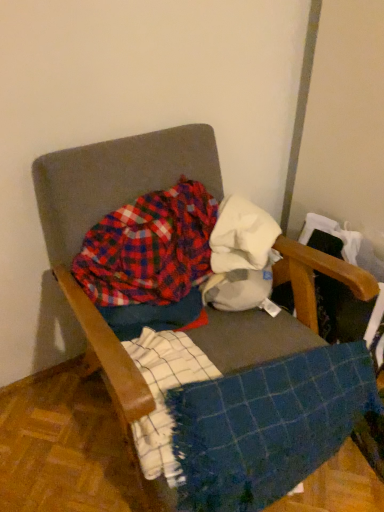
Question: Is plaid cotton shirt at center placed right next to white cotton cloth at center?

Choices:
 (A) no
 (B) yes

Answer: (A)

Question: Can you confirm if plaid cotton shirt at center is taller than white cotton cloth at center?

Choices:
 (A) no
 (B) yes

Answer: (B)

Question: Is the position of plaid cotton shirt at center less distant than that of white cotton cloth at center?

Choices:
 (A) no
 (B) yes

Answer: (B)

Question: From the image's perspective, would you say plaid cotton shirt at center is shown under white cotton cloth at center?

Choices:
 (A) no
 (B) yes

Answer: (B)

Question: Considering the relative positions of plaid cotton shirt at center and white cotton cloth at center in the image provided, is plaid cotton shirt at center behind white cotton cloth at center?

Choices:
 (A) no
 (B) yes

Answer: (A)

Question: Is plaid cotton shirt at center taller or shorter than textured fabric chair at center?

Choices:
 (A) short
 (B) tall

Answer: (A)

Question: From the image's perspective, relative to textured fabric chair at center, is plaid cotton shirt at center above or below?

Choices:
 (A) below
 (B) above

Answer: (B)

Question: Considering their positions, is plaid cotton shirt at center located in front of or behind textured fabric chair at center?

Choices:
 (A) front
 (B) behind

Answer: (B)

Question: Is point (175, 256) positioned closer to the camera than point (72, 166)?

Choices:
 (A) closer
 (B) farther

Answer: (B)

Question: Considering their positions, is plaid cotton shirt at center located in front of or behind white cotton cloth at center?

Choices:
 (A) behind
 (B) front

Answer: (B)

Question: Is plaid cotton shirt at center inside or outside of white cotton cloth at center?

Choices:
 (A) inside
 (B) outside

Answer: (B)

Question: In terms of size, does plaid cotton shirt at center appear bigger or smaller than white cotton cloth at center?

Choices:
 (A) big
 (B) small

Answer: (A)

Question: Is plaid cotton shirt at center taller or shorter than white cotton cloth at center?

Choices:
 (A) short
 (B) tall

Answer: (B)

Question: From the image's perspective, is blue woven blanket at center located above or below plaid cotton shirt at center?

Choices:
 (A) below
 (B) above

Answer: (A)

Question: Would you say blue woven blanket at center is inside or outside plaid cotton shirt at center?

Choices:
 (A) inside
 (B) outside

Answer: (B)